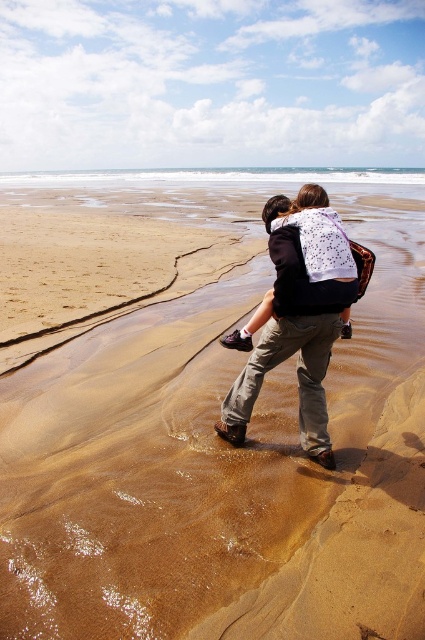
Is point (127, 413) farther from viewer compared to point (175, 179)?

No.

Which is behind, point (113, 548) or point (399, 170)?

Positioned behind is point (399, 170).

The image size is (425, 640). What do you see at coordinates (223, 468) in the screenshot? I see `brown sand at center` at bounding box center [223, 468].

Where is `brown sand at center`? brown sand at center is located at coordinates (223, 468).

Which of these two, matte black hoodie at center or clear water at center, stands taller?

With more height is clear water at center.

Can you confirm if matte black hoodie at center is taller than clear water at center?

Incorrect, matte black hoodie at center's height is not larger of clear water at center's.

The image size is (425, 640). Describe the element at coordinates (299, 317) in the screenshot. I see `matte black hoodie at center` at that location.

This screenshot has height=640, width=425. Identify the location of matte black hoodie at center. (299, 317).

Who is positioned more to the left, brown sand at center or matte black hoodie at center?

Positioned to the left is brown sand at center.

Which is in front, point (11, 412) or point (306, 196)?

Point (306, 196) is in front.

Locate an element on the screen. The image size is (425, 640). brown sand at center is located at coordinates [x=223, y=468].